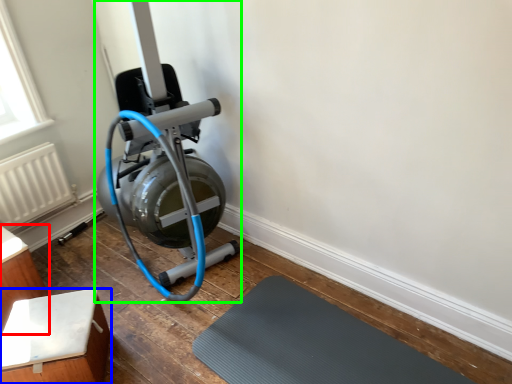
Question: Considering the real-world distances, which object is closest to furniture (highlighted by a red box)? furniture (highlighted by a blue box) or stationary bicycle (highlighted by a green box).

Choices:
 (A) furniture
 (B) stationary bicycle

Answer: (A)